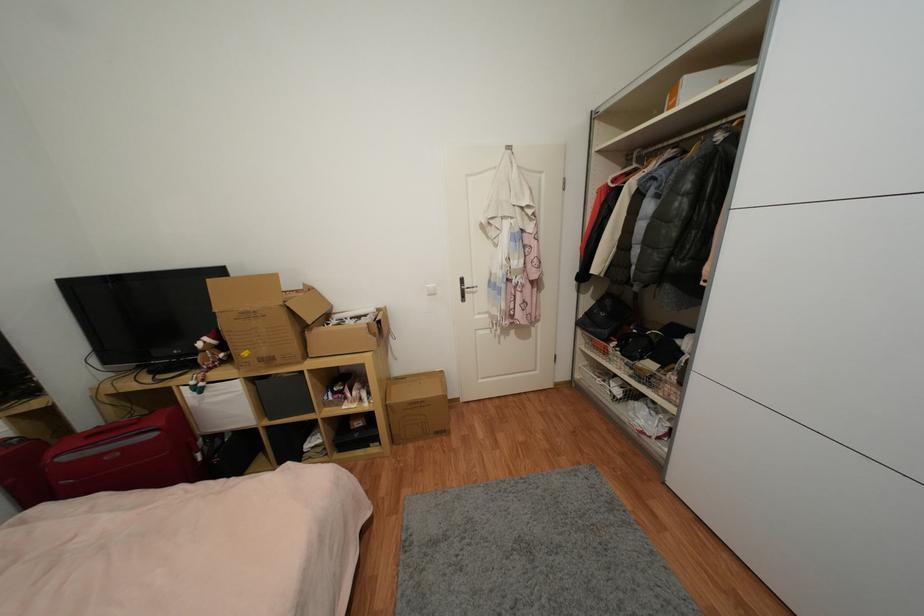
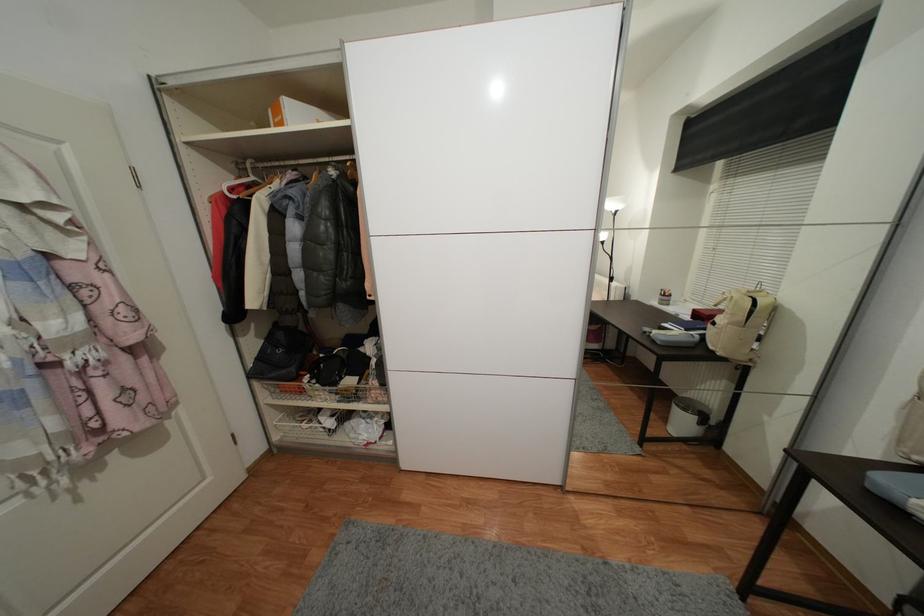
Question: Based on the continuous images, in which direction is the camera rotating? Reply with the corresponding letter.

Choices:
 (A) Left
 (B) Right
 (C) Up
 (D) Down

Answer: (B)